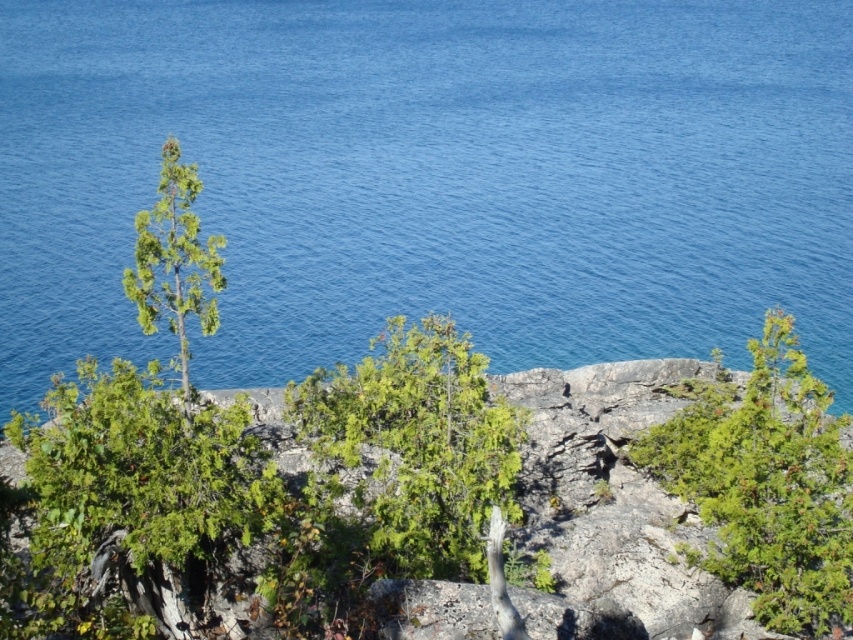
Question: Which is farther from the green leafy shrub at center?

Choices:
 (A) green textured shrub at center-right
 (B) green matte tree at upper left

Answer: (A)

Question: Which of the following is the closest to the observer?

Choices:
 (A) (415, 35)
 (B) (766, 541)
 (C) (437, 524)

Answer: (B)

Question: Which of the following is the farthest from the observer?

Choices:
 (A) (534, 250)
 (B) (711, 554)
 (C) (486, 458)

Answer: (A)

Question: Is blue water at upper center thinner than green leafy shrub at center?

Choices:
 (A) yes
 (B) no

Answer: (B)

Question: Can you confirm if green textured shrub at center-right is smaller than green matte tree at upper left?

Choices:
 (A) yes
 (B) no

Answer: (A)

Question: Can you confirm if green textured shrub at center-right is smaller than green matte tree at upper left?

Choices:
 (A) no
 (B) yes

Answer: (B)